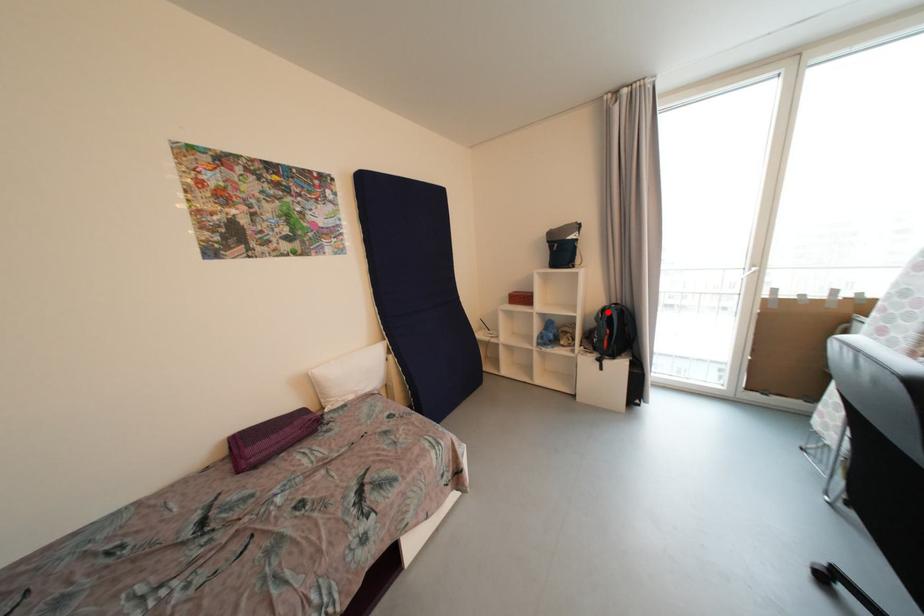
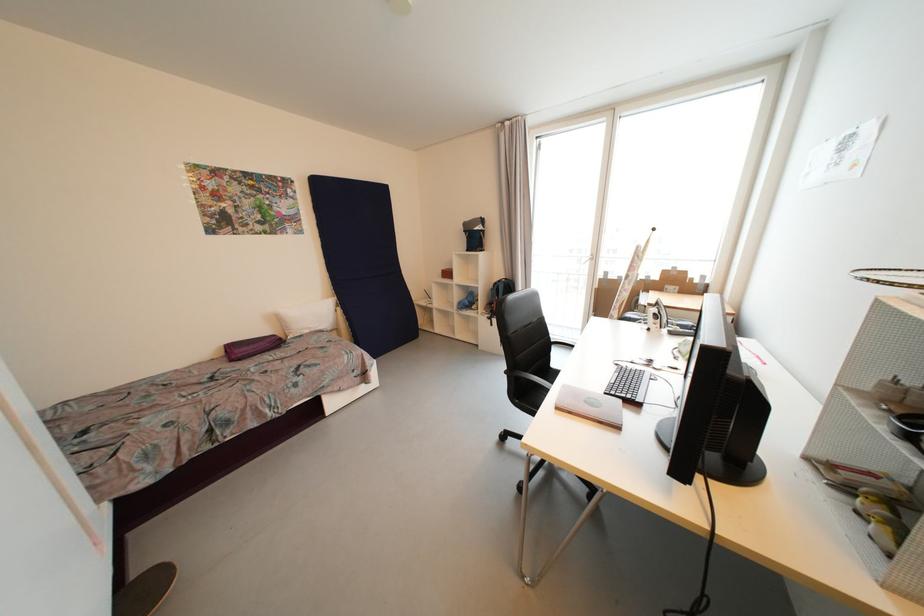
Where in the second image is the point corresponding to the highlighted location from the first image?

(501, 285)